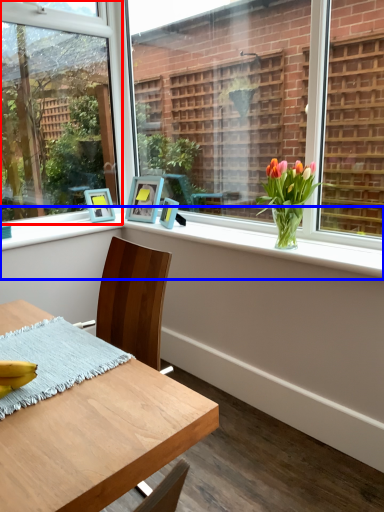
Question: Which object is further to the camera taking this photo, window (highlighted by a red box) or window sill (highlighted by a blue box)?

Choices:
 (A) window
 (B) window sill

Answer: (A)